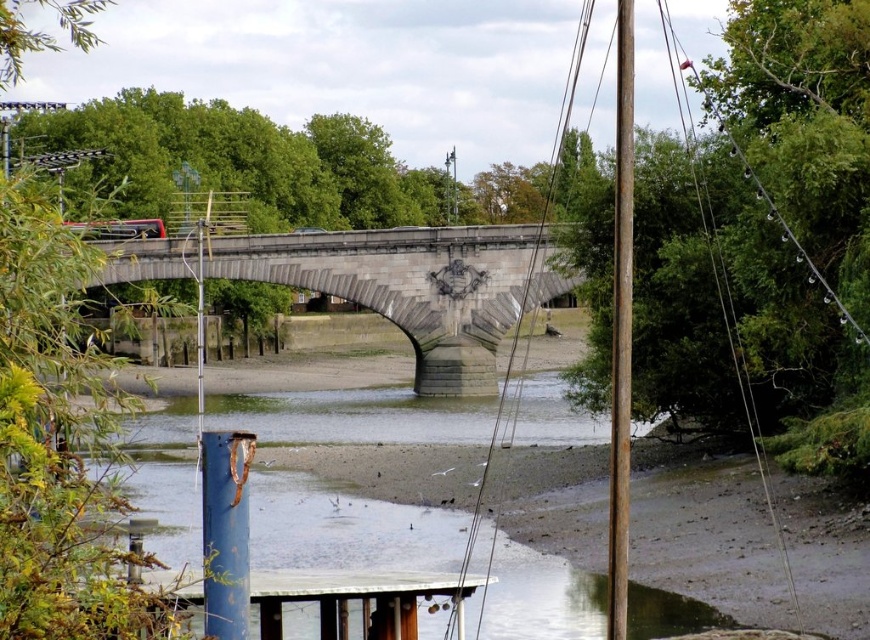
In the scene shown: You are an engineer assessing the structural integrity of the gray stone bridge at center and the rusty metal pole at right. Which structure has a lower height? Please base your answer on the scene description provided.

The gray stone bridge at center has a lesser height compared to the rusty metal pole at right, so the gray stone bridge at center is the structure with lower height.

You are standing at point A, which is located at coordinates (415, 285). What object is exactly at your current position?

The gray stone bridge at center is exactly at point A, which is located at coordinates (415, 285).